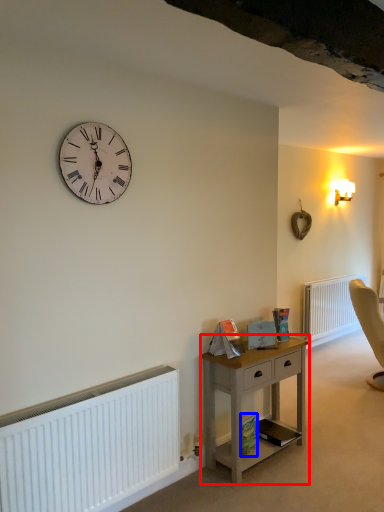
Question: Which of the following is the closest to the observer, nightstand (highlighted by a red box) or book (highlighted by a blue box)?

Choices:
 (A) nightstand
 (B) book

Answer: (A)